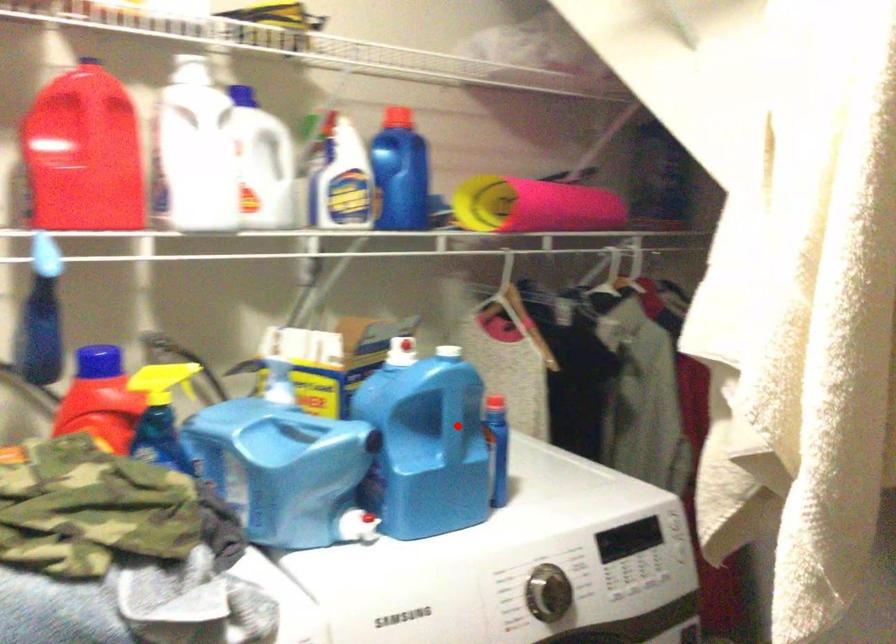
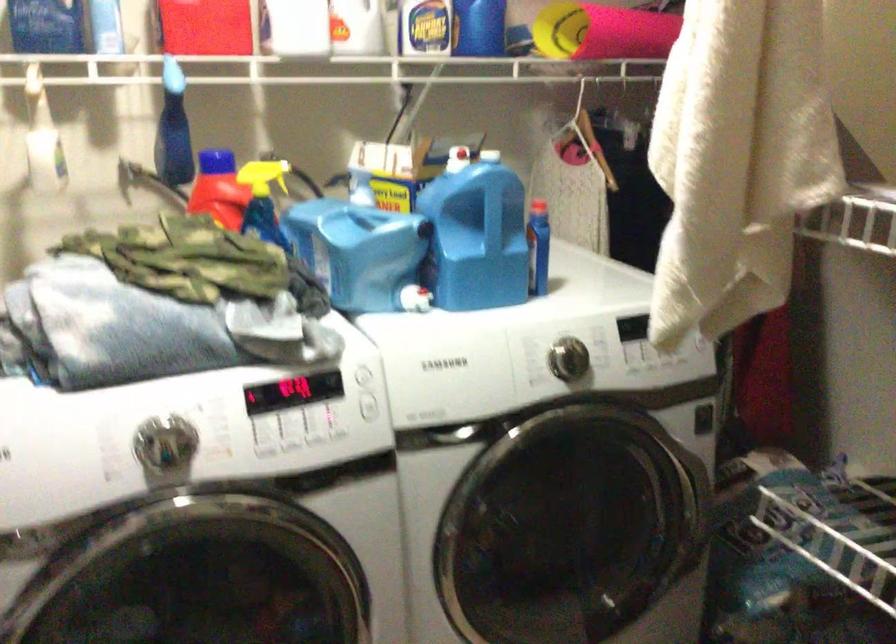
Question: I am providing you with two images of the same scene from different viewpoints. Given a red point in image1, look at the same physical point in image2. Is it:

Choices:
 (A) Closer to the viewpoint
 (B) Farther from the viewpoint

Answer: (B)